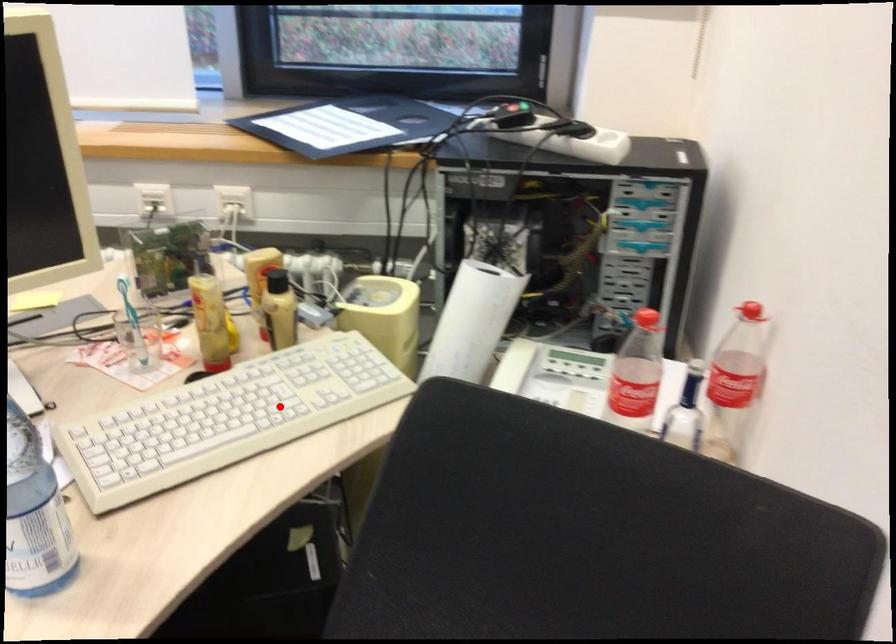
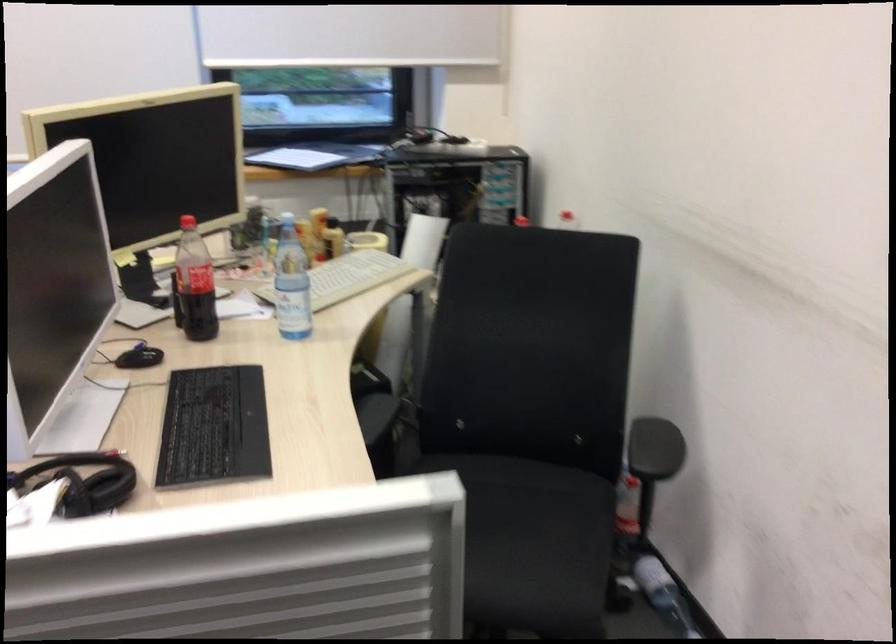
Question: I am providing you with two images of the same scene from different viewpoints. Image1 has a red point marked. In image2, the corresponding 3D location appears at what relative position? Reply with the corresponding letter.

Choices:
 (A) Closer
 (B) Farther

Answer: (B)